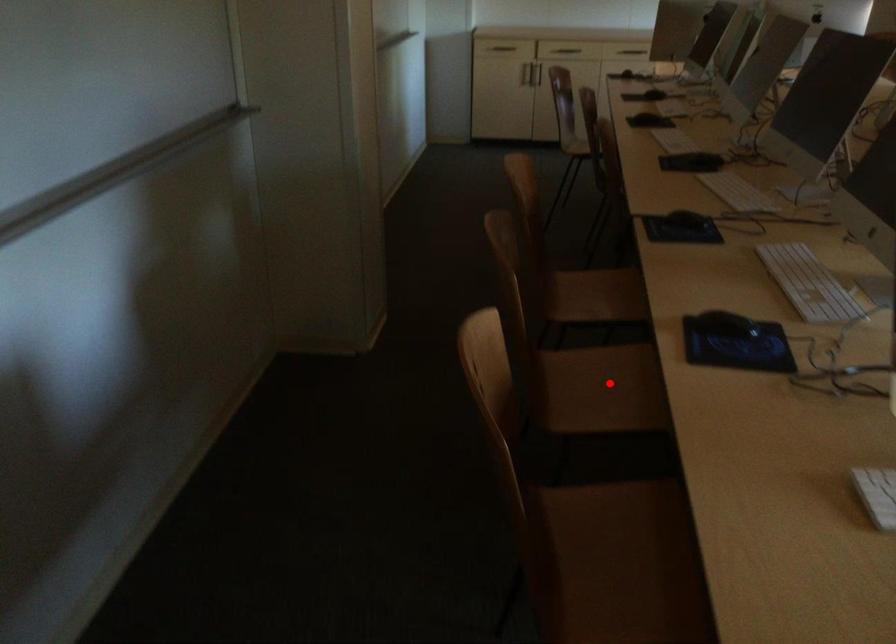
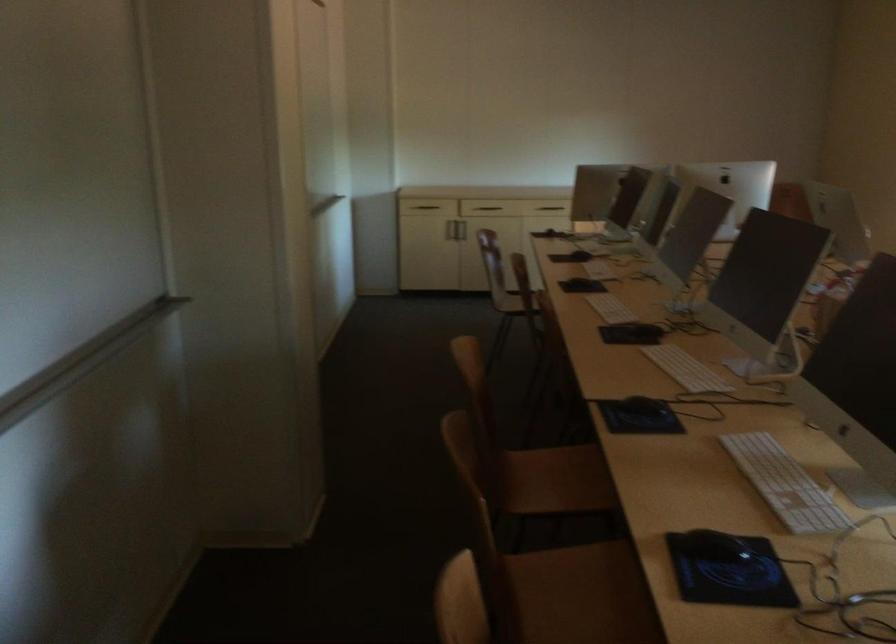
The point at the highlighted location is marked in the first image. Where is the corresponding point in the second image?

(581, 594)